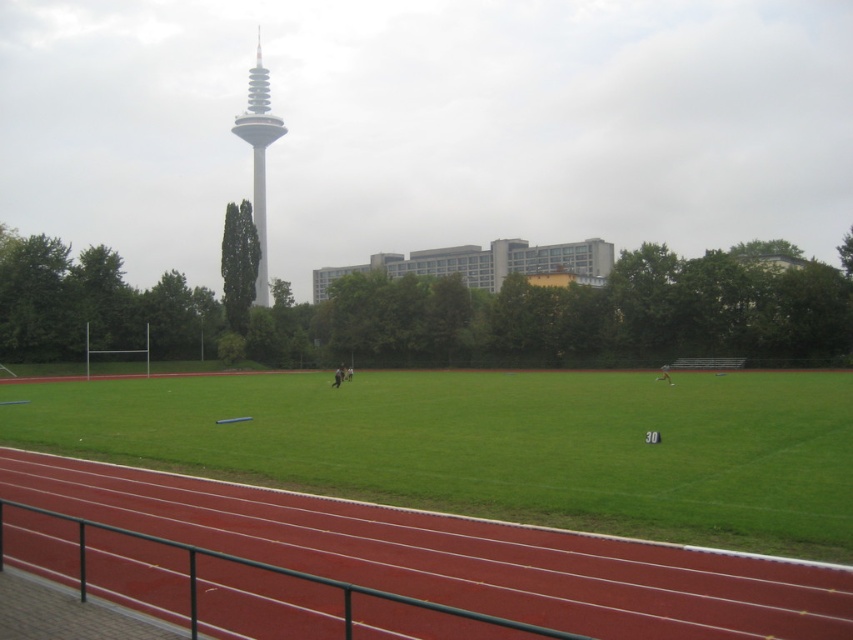
Does rubberized red track at lower left have a greater height compared to white smooth tower at upper center?

No.

Is rubberized red track at lower left thinner than white smooth tower at upper center?

Yes.

Which is in front, point (532, 593) or point (262, 77)?

Point (532, 593)

This screenshot has height=640, width=853. Find the location of `rubberized red track at lower left`. rubberized red track at lower left is located at coordinates (457, 556).

Is green grass at center above rubberized red track at lower left?

Actually, green grass at center is below rubberized red track at lower left.

Locate an element on the screen. This screenshot has height=640, width=853. green grass at center is located at coordinates (496, 445).

Does green grass at center have a lesser width compared to white smooth tower at upper center?

No, green grass at center is not thinner than white smooth tower at upper center.

Between point (142, 396) and point (265, 134), which one is positioned behind?

Point (265, 134)

From the picture: Who is more forward, (572,413) or (260,278)?

Point (572,413) is more forward.

Identify the location of green grass at center. This screenshot has height=640, width=853. (496, 445).